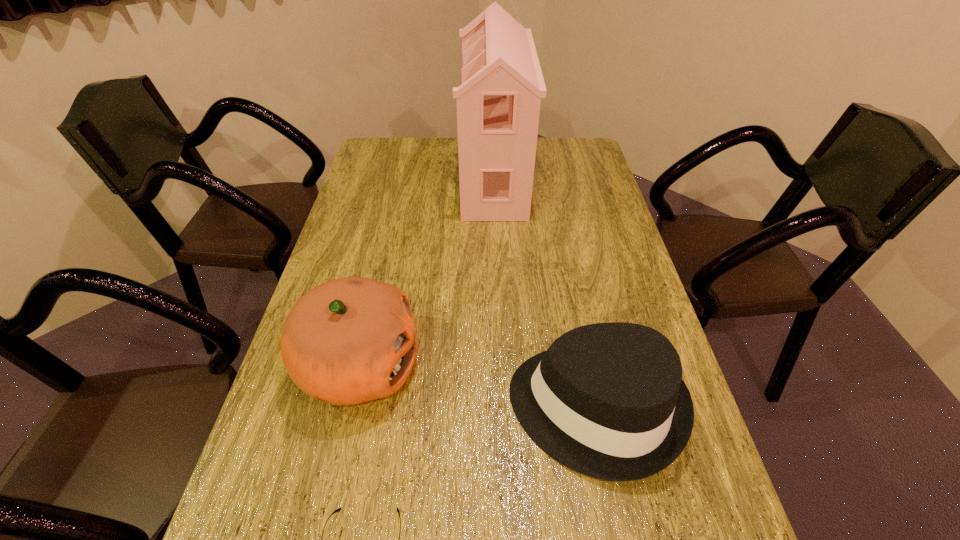
In order to click on object that ranks as the closest to the shortest object in this screenshot , I will do `click(350, 340)`.

Where is `the second closest object to the pumpkin`? The height and width of the screenshot is (540, 960). the second closest object to the pumpkin is located at coordinates (607, 400).

Where is `vacant space that satisfies the following two spatial constraints: 1. on the front-facing side of the second shortest object; 2. on the left side of the tallest object`? Image resolution: width=960 pixels, height=540 pixels. vacant space that satisfies the following two spatial constraints: 1. on the front-facing side of the second shortest object; 2. on the left side of the tallest object is located at coordinates (503, 408).

Where is `vacant position in the image that satisfies the following two spatial constraints: 1. on the back side of the fedora; 2. on the face of the pumpkin`? vacant position in the image that satisfies the following two spatial constraints: 1. on the back side of the fedora; 2. on the face of the pumpkin is located at coordinates (587, 366).

You are a GUI agent. You are given a task and a screenshot of the screen. Output one action in this format:
    pyautogui.click(x=<x>, y=<y>)
    Task: Click on the vacant space that satisfies the following two spatial constraints: 1. on the face of the second tallest object; 2. on the right side of the fedora
    The width and height of the screenshot is (960, 540).
    Given the screenshot: What is the action you would take?
    pyautogui.click(x=350, y=408)

You are a GUI agent. You are given a task and a screenshot of the screen. Output one action in this format:
    pyautogui.click(x=<x>, y=<y>)
    Task: Click on the vacant position in the image that satisfies the following two spatial constraints: 1. on the face of the pumpkin; 2. on the left side of the fedora
    The width and height of the screenshot is (960, 540).
    Given the screenshot: What is the action you would take?
    pyautogui.click(x=350, y=408)

I want to click on vacant area in the image that satisfies the following two spatial constraints: 1. on the face of the second tallest object; 2. on the back side of the fedora, so click(350, 408).

You are a GUI agent. You are given a task and a screenshot of the screen. Output one action in this format:
    pyautogui.click(x=<x>, y=<y>)
    Task: Click on the vacant region that satisfies the following two spatial constraints: 1. on the back side of the fedora; 2. on the front-facing side of the farthest object
    
    Given the screenshot: What is the action you would take?
    pyautogui.click(x=549, y=178)